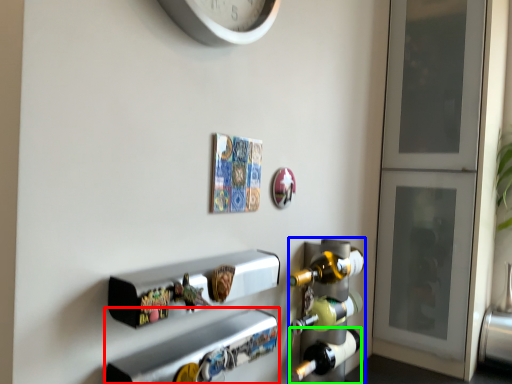
Question: Considering the real-world distances, which object is closest to shelf (highlighted by a red box)? wine rack (highlighted by a blue box) or beer bottle (highlighted by a green box).

Choices:
 (A) wine rack
 (B) beer bottle

Answer: (A)